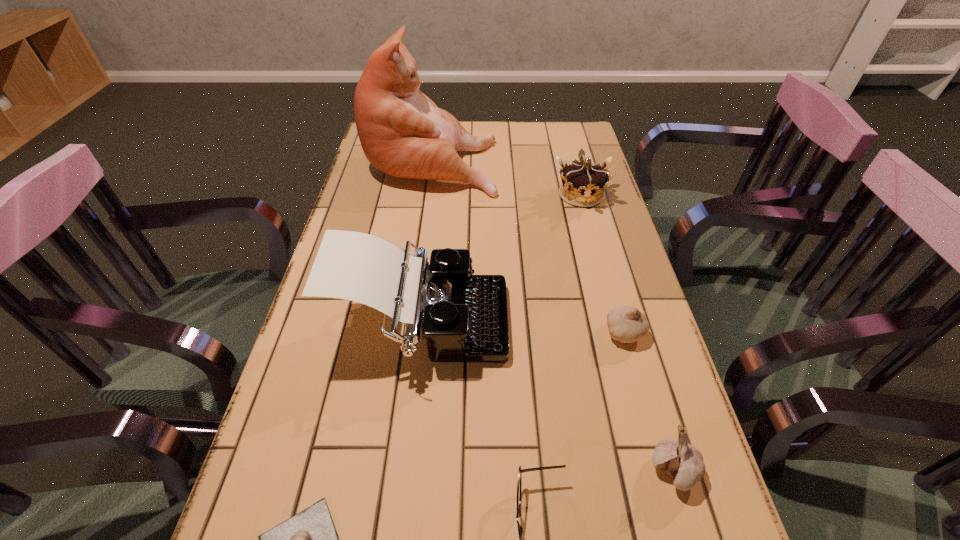
Locate an element on the screen. This screenshot has width=960, height=540. blank space that satisfies the following two spatial constraints: 1. on the keys of the typewriter; 2. on the back side of the second farthest garlic is located at coordinates [x=405, y=470].

Locate an element on the screen. This screenshot has height=540, width=960. free spot that satisfies the following two spatial constraints: 1. on the keys of the second tallest object; 2. on the back side of the second tallest garlic is located at coordinates pyautogui.click(x=420, y=332).

At what (x,y) coordinates should I click in order to perform the action: click on free spot that satisfies the following two spatial constraints: 1. on the keys of the second tallest object; 2. on the back side of the third shortest object. Please return your answer as a coordinate pair (x, y). Looking at the image, I should click on (420, 332).

Where is `vacant area in the image that satisfies the following two spatial constraints: 1. on the keys of the fourth shortest object; 2. on the left side of the typewriter`? The image size is (960, 540). vacant area in the image that satisfies the following two spatial constraints: 1. on the keys of the fourth shortest object; 2. on the left side of the typewriter is located at coordinates (405, 470).

This screenshot has width=960, height=540. Identify the location of vacant point that satisfies the following two spatial constraints: 1. on the keys of the fifth tallest object; 2. on the right side of the typewriter. (420, 332).

Where is `free space that satisfies the following two spatial constraints: 1. on the back side of the fourth shortest object; 2. on the face of the tallest object`? The width and height of the screenshot is (960, 540). free space that satisfies the following two spatial constraints: 1. on the back side of the fourth shortest object; 2. on the face of the tallest object is located at coordinates (582, 161).

Where is `free location that satisfies the following two spatial constraints: 1. on the keys of the third shortest object; 2. on the left side of the typewriter`? The width and height of the screenshot is (960, 540). free location that satisfies the following two spatial constraints: 1. on the keys of the third shortest object; 2. on the left side of the typewriter is located at coordinates (420, 332).